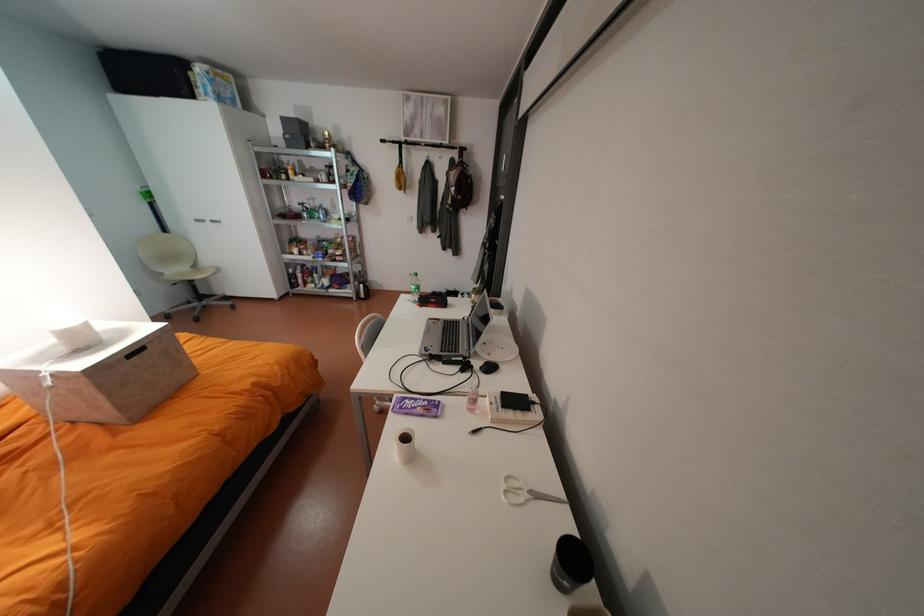
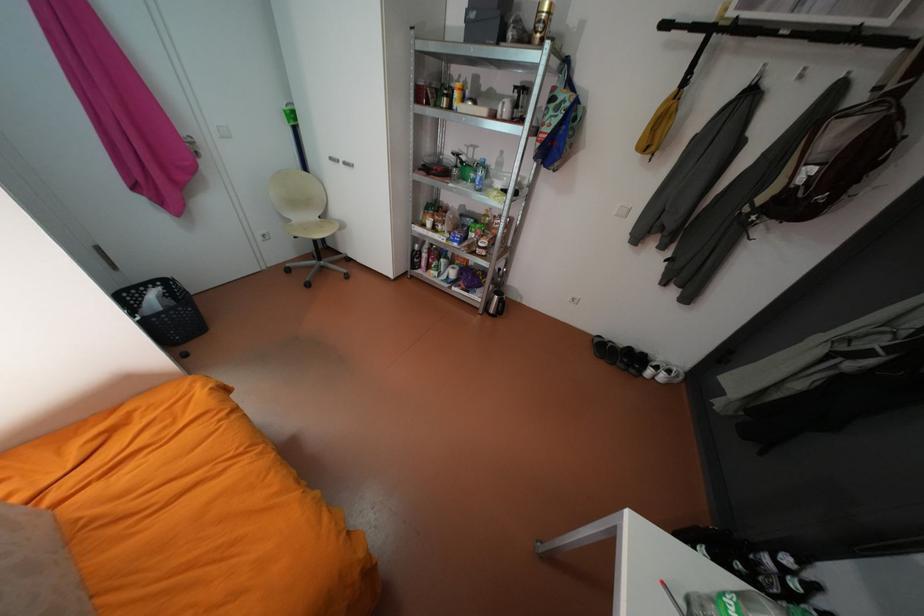
The point at (360, 297) is marked in the first image. Where is the corresponding point in the second image?

(487, 308)